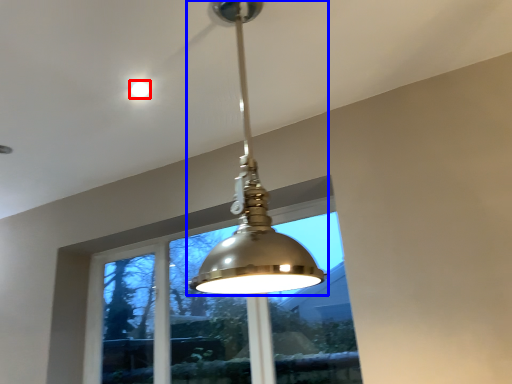
Question: Which of the following is the closest to the observer, droplight (highlighted by a red box) or lamp (highlighted by a blue box)?

Choices:
 (A) droplight
 (B) lamp

Answer: (B)